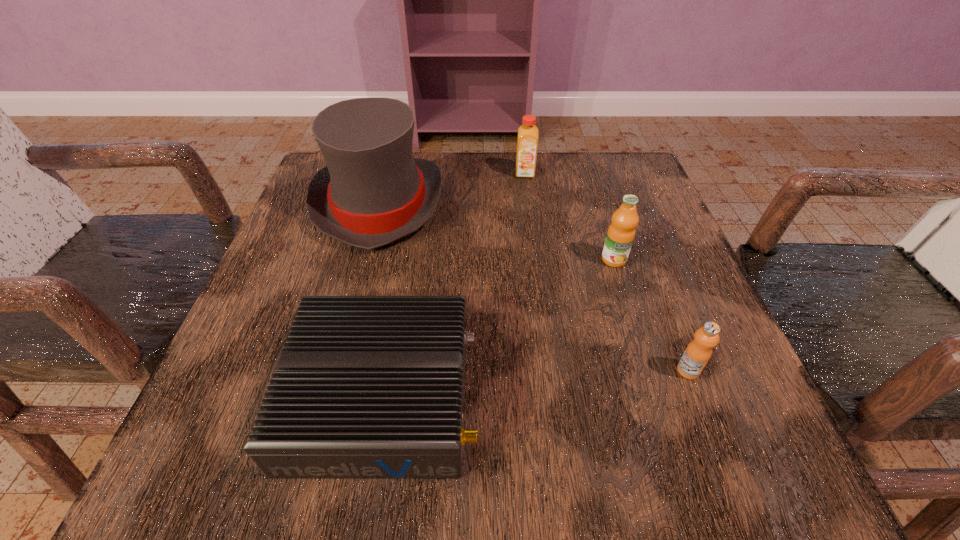
In order to click on vacant area at the far edge of the desktop in this screenshot , I will do `click(566, 171)`.

Locate an element on the screen. The height and width of the screenshot is (540, 960). vacant area at the near edge is located at coordinates (546, 433).

This screenshot has width=960, height=540. I want to click on vacant position at the left edge of the desktop, so click(x=231, y=387).

Locate an element on the screen. This screenshot has width=960, height=540. vacant space at the right edge of the desktop is located at coordinates (655, 255).

You are a GUI agent. You are given a task and a screenshot of the screen. Output one action in this format:
    pyautogui.click(x=<x>, y=<y>)
    Task: Click on the vacant space at the near left corner
    
    Given the screenshot: What is the action you would take?
    pyautogui.click(x=210, y=467)

Identify the location of free space at the far right corner of the desktop. This screenshot has height=540, width=960. (572, 167).

The image size is (960, 540). I want to click on free space at the near right corner, so click(700, 454).

Where is `unoccupied area between the tallest object and the fourth object from left to right`? This screenshot has width=960, height=540. unoccupied area between the tallest object and the fourth object from left to right is located at coordinates (496, 232).

The width and height of the screenshot is (960, 540). I want to click on free area in between the third object from right to left and the dress hat, so click(452, 188).

At what (x,y) coordinates should I click in order to perform the action: click on vacant area between the nearest orange juice and the dress hat. Please return your answer as a coordinate pair (x, y). Image resolution: width=960 pixels, height=540 pixels. Looking at the image, I should click on (534, 287).